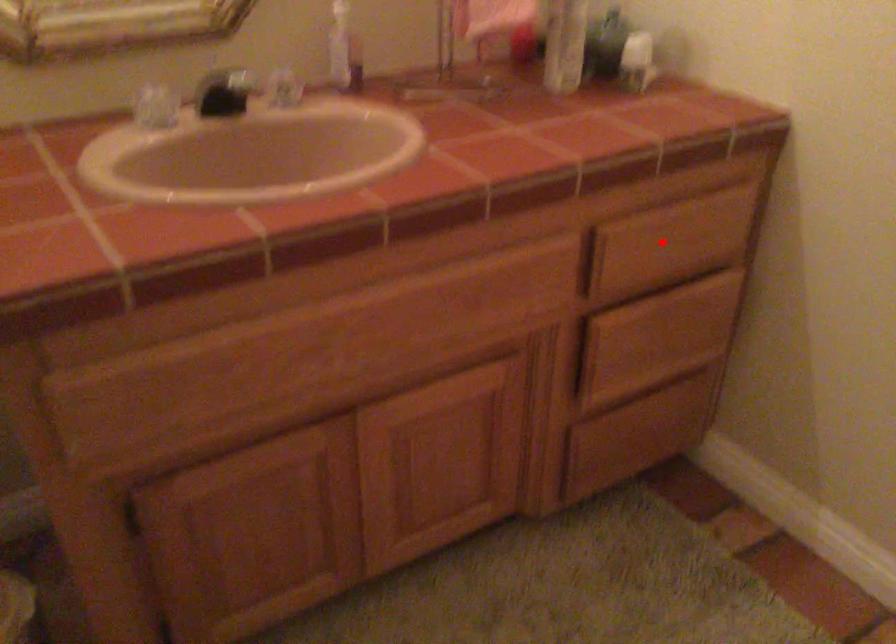
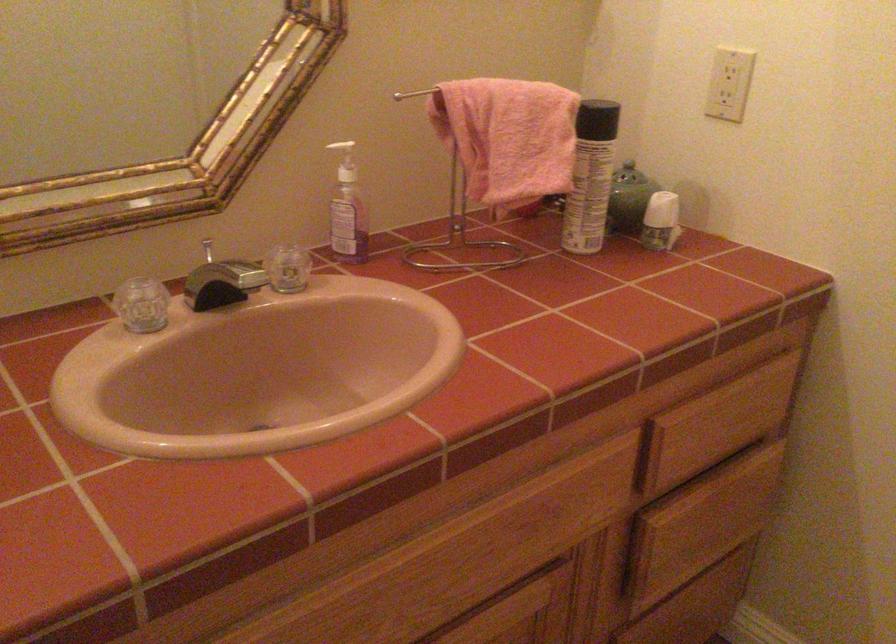
Locate, in the second image, the point that corresponds to the highlighted location in the first image.

(718, 424)